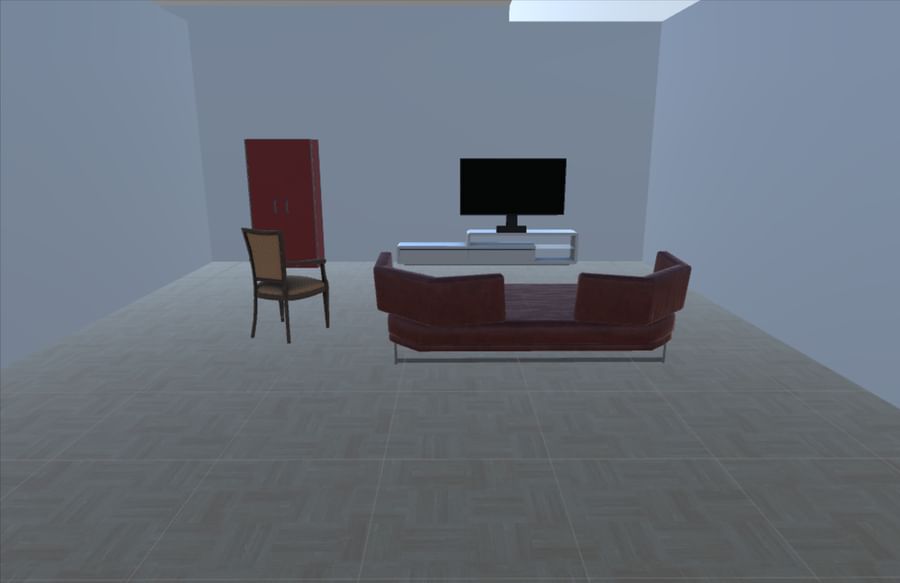
The image size is (900, 583). Find the location of `back of sofa`. back of sofa is located at coordinates (459, 303), (610, 304).